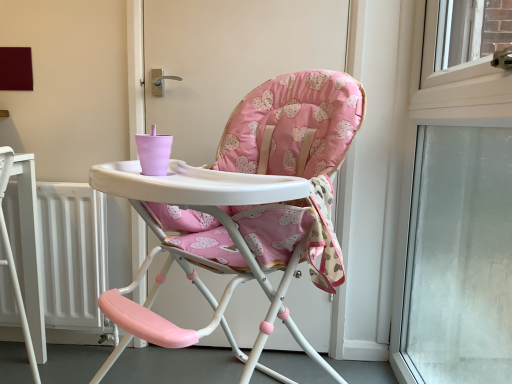
The image size is (512, 384). Identify the location of vacant area that is situated to the right of white matte radiator at lower left. (121, 366).